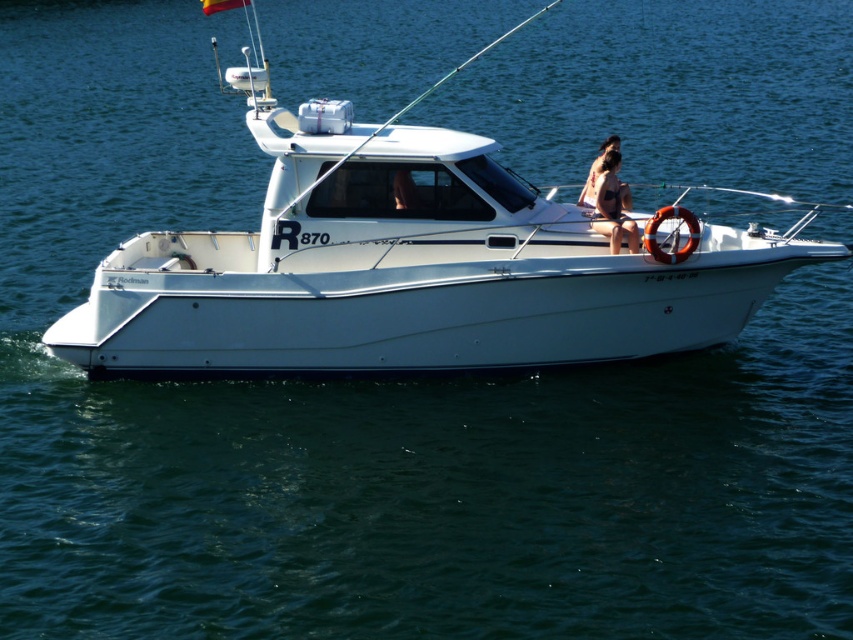
You are a photographer taking a picture of the tan skin bikini at center and the tan skin person at center on a boat. Where should you position your camera to ensure both objects are clearly visible in the frame?

Position the camera above the tan skin person at center so that the tan skin bikini at center, which is located below them, is visible in the frame.

You are a photographer trying to capture the tan skin bikini at center and the white matte boat at center in a single shot. Based on their positions, which object is closer to the left edge of the frame?

The white matte boat at center is positioned on the left side of tan skin bikini at center, so it is closer to the left edge of the frame.